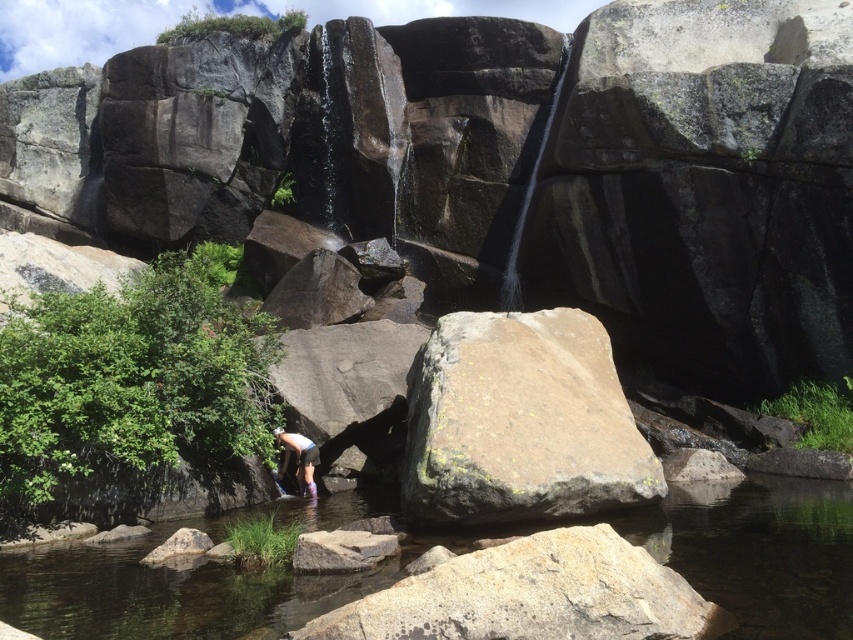
You are standing at the edge of the rocky landscape and want to take a photo of both the clear water at center and the brown rough rock at center. Which object should you focus on first if you want both to be in sharp focus?

You should focus on the brown rough rock at center first because it is farther away from the viewer than the clear water at center. By focusing on the farther object, you can ensure both are in focus due to the depth of field.

You are a hiker trying to cross the rocky area. You see the brown rough rock at center and the white matte shorts at lower center. Which object can you step on first if you move forward?

The white matte shorts at lower center can be stepped on first because it is located at lower center, closer to the starting position than the brown rough rock at center.

You are standing at the point marked as point (520, 422) in the image. Based on the scene description, what object is located exactly at that point?

The point (520, 422) marks the brown rough rock at center.